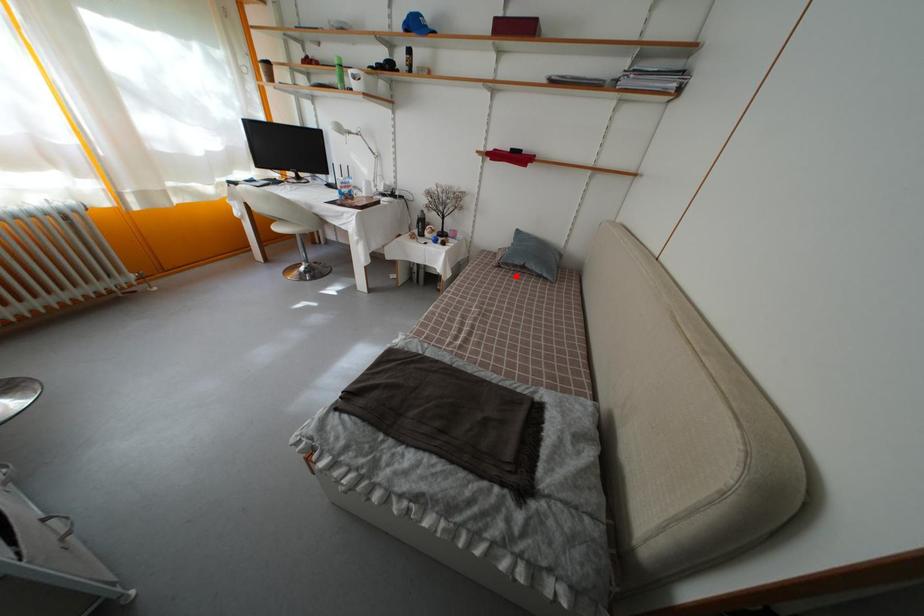
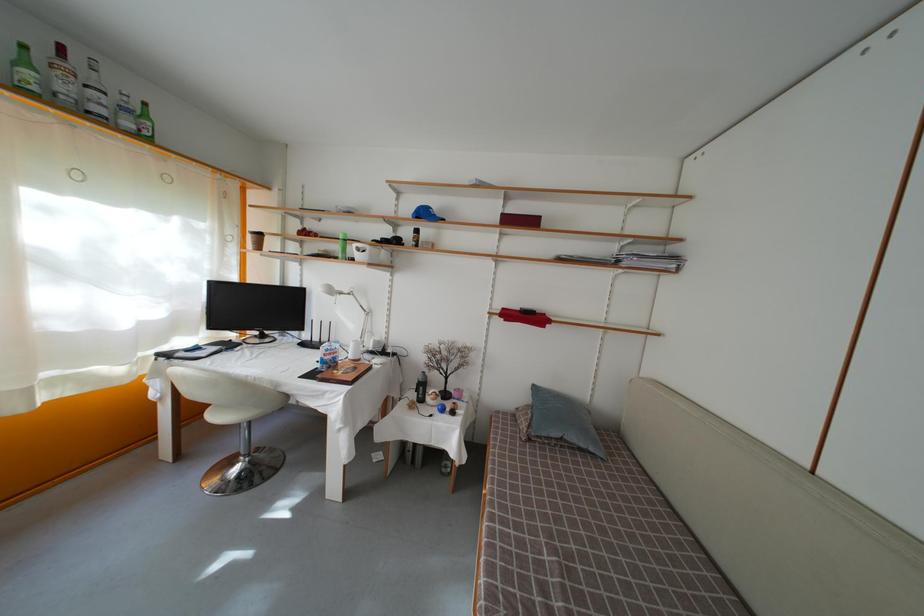
In the second image, find the point that corresponds to the highlighted location in the first image.

(550, 450)